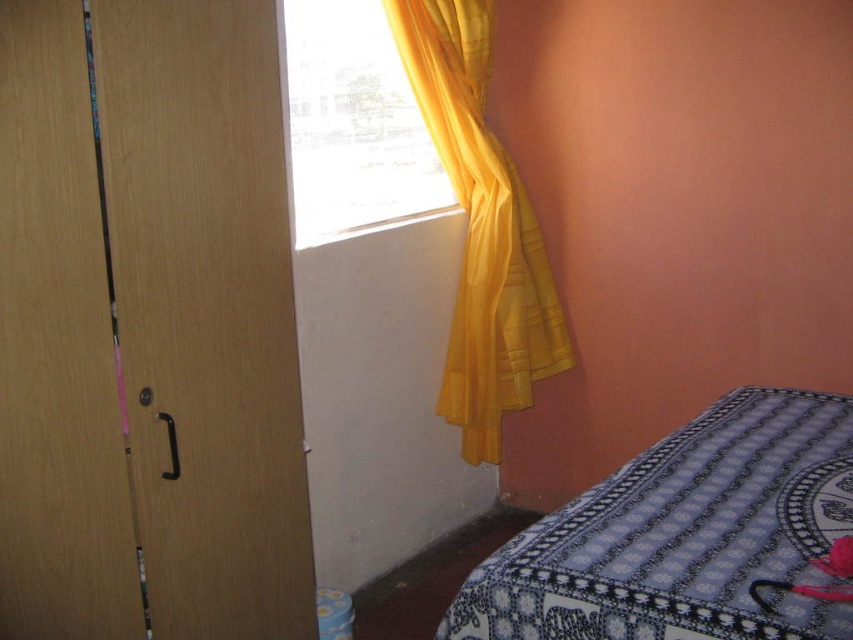
Question: Does yellow sheer curtain at upper left appear on the left side of yellow sheer curtain at upper center?

Choices:
 (A) yes
 (B) no

Answer: (B)

Question: Is wooden closet at left positioned before blue printed fabric at lower right?

Choices:
 (A) yes
 (B) no

Answer: (B)

Question: Considering the real-world distances, which object is closest to the blue printed fabric at lower right?

Choices:
 (A) yellow sheer curtain at upper center
 (B) yellow sheer curtain at upper left
 (C) wooden closet at left

Answer: (C)

Question: Which is nearer to the wooden closet at left?

Choices:
 (A) yellow sheer curtain at upper center
 (B) blue printed fabric at lower right

Answer: (B)

Question: Among these objects, which one is nearest to the camera?

Choices:
 (A) yellow sheer curtain at upper center
 (B) wooden closet at left

Answer: (B)

Question: Is wooden closet at left to the right of yellow sheer curtain at upper center from the viewer's perspective?

Choices:
 (A) yes
 (B) no

Answer: (B)